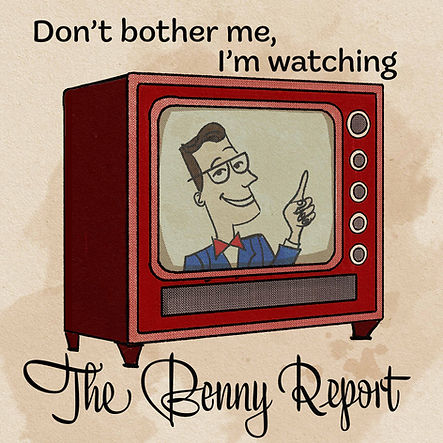
Image resolution: width=443 pixels, height=443 pixels. Find the location of `background behind tv`. background behind tv is located at coordinates (402, 225).